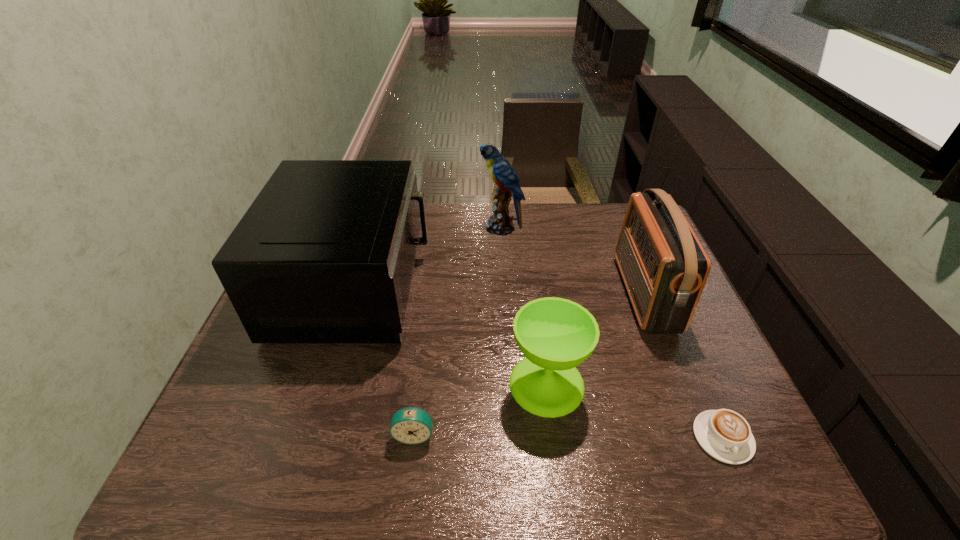
The height and width of the screenshot is (540, 960). I want to click on cappuccino that is at the right edge, so click(x=725, y=435).

This screenshot has width=960, height=540. What are the coordinates of `object positioned at the far left corner` in the screenshot? It's located at (325, 254).

You are a GUI agent. You are given a task and a screenshot of the screen. Output one action in this format:
    pyautogui.click(x=<x>, y=<y>)
    Task: Click on the object that is at the near right corner
    Image resolution: width=960 pixels, height=540 pixels.
    Given the screenshot: What is the action you would take?
    pyautogui.click(x=725, y=435)

Identify the location of free region at the far edge of the desktop. (477, 215).

Where is `blank area at the near edge`? The height and width of the screenshot is (540, 960). blank area at the near edge is located at coordinates (542, 465).

In the image, there is a desktop. Where is `vacant region at the left edge`? vacant region at the left edge is located at coordinates (274, 403).

You are a GUI agent. You are given a task and a screenshot of the screen. Output one action in this format:
    pyautogui.click(x=<x>, y=<y>)
    Task: Click on the vacant space at the far right corner
    The height and width of the screenshot is (540, 960).
    Given the screenshot: What is the action you would take?
    pyautogui.click(x=616, y=205)

Locate an element on the screen. The height and width of the screenshot is (540, 960). vacant space that is in between the fourth tallest object and the shortest object is located at coordinates (635, 411).

Where is `unoccupied position between the microwave_oven and the second shortest object`? Image resolution: width=960 pixels, height=540 pixels. unoccupied position between the microwave_oven and the second shortest object is located at coordinates (385, 360).

This screenshot has height=540, width=960. Find the location of `free spot between the microwave_oven and the radio receiver`. free spot between the microwave_oven and the radio receiver is located at coordinates (500, 290).